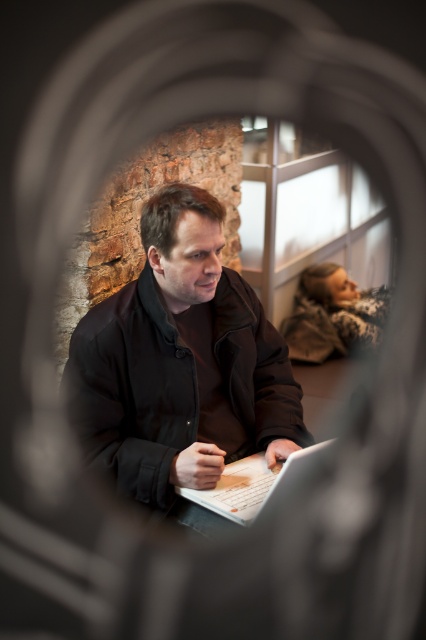
You are a photographer who wants to capture both the matte black laptop at center and the white matte laptop at center through the heart frame. Which laptop is located to the left of the other?

The matte black laptop at center is positioned on the left side of the white matte laptop at center.

You are trying to place a new object exactly where the matte black laptop at center is currently located. What coordinates should you use to ensure it is placed in the same spot?

The coordinates for the matte black laptop at center are at point (x=181, y=365), so you should use these coordinates to place the new object in the same spot.